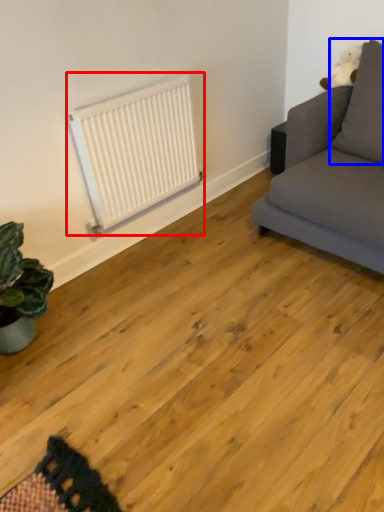
Question: Which of the following is the farthest to the observer, radiator (highlighted by a red box) or pillow (highlighted by a blue box)?

Choices:
 (A) radiator
 (B) pillow

Answer: (A)